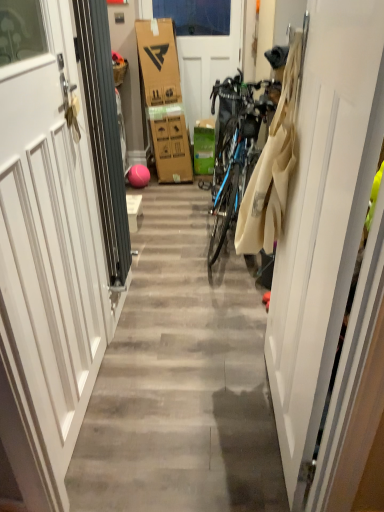
Question: Is white matte door at center, the 3th door viewed from the back, oriented away from green cardboard box at center?

Choices:
 (A) yes
 (B) no

Answer: (B)

Question: From the image's perspective, is white matte door at center, which is the first door from front to back, below green cardboard box at center?

Choices:
 (A) yes
 (B) no

Answer: (A)

Question: Considering the relative positions of white matte door at center, the 3th door viewed from the back, and green cardboard box at center in the image provided, is white matte door at center, the 3th door viewed from the back, to the right of green cardboard box at center from the viewer's perspective?

Choices:
 (A) yes
 (B) no

Answer: (A)

Question: Is white matte door at center, the first door viewed from the right, touching green cardboard box at center?

Choices:
 (A) no
 (B) yes

Answer: (A)

Question: Can you confirm if white matte door at center, the 3th door viewed from the back, is wider than green cardboard box at center?

Choices:
 (A) no
 (B) yes

Answer: (A)

Question: Would you say white matte door at center, which is the first door from front to back, contains green cardboard box at center?

Choices:
 (A) no
 (B) yes

Answer: (A)

Question: Is beige cotton laundry at right located outside green cardboard box at center?

Choices:
 (A) yes
 (B) no

Answer: (A)

Question: Is beige cotton laundry at right with green cardboard box at center?

Choices:
 (A) yes
 (B) no

Answer: (B)

Question: From a real-world perspective, is beige cotton laundry at right below green cardboard box at center?

Choices:
 (A) yes
 (B) no

Answer: (B)

Question: Is beige cotton laundry at right positioned before green cardboard box at center?

Choices:
 (A) yes
 (B) no

Answer: (A)

Question: From a real-world perspective, is beige cotton laundry at right physically above green cardboard box at center?

Choices:
 (A) no
 (B) yes

Answer: (B)

Question: Is beige cotton laundry at right at the left side of green cardboard box at center?

Choices:
 (A) no
 (B) yes

Answer: (A)

Question: Is white matte door at center, which is counted as the first door, starting from the back, thinner than white matte door at center, the first door viewed from the right?

Choices:
 (A) no
 (B) yes

Answer: (A)